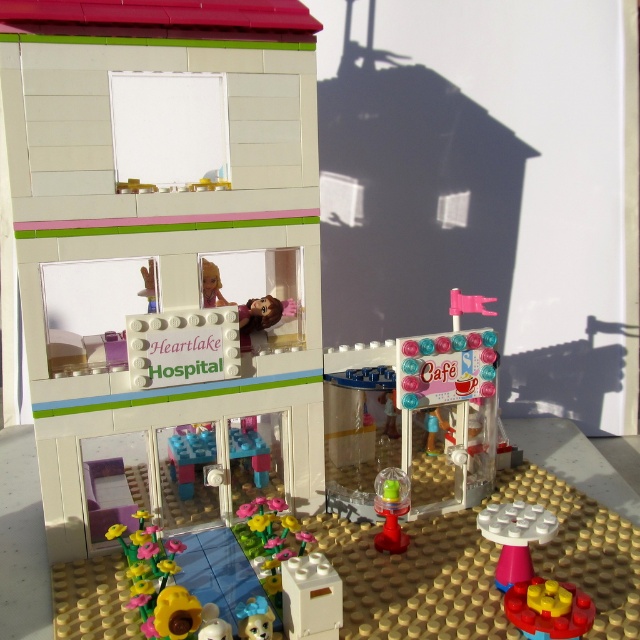
You are a child playing with the LEGO set and want to place a small LEGO figure between the yellow rubber toy at lower right and the translucent yellow plastic cup at lower center. Can you fit the figure between them?

The yellow rubber toy at lower right is positioned on the right side of the translucent yellow plastic cup at lower center, so there is space between them to place the LEGO figure.

You are a photographer standing in front of the LEGO town scene. You want to take a photo focusing on both the point at location (515, 552) and the point at (403, 499). Which point should you adjust your camera focus on first to ensure the closer object is sharp?

Point (515, 552) is closer to the camera than point (403, 499), so you should focus on point (515, 552) first to ensure the closer object is in sharp focus.

You are a LEGO figure standing at point (397, 548) and want to walk to the Heartlake Hospital. Is the point (573, 586) in your path towards the hospital?

Yes, the point (573, 586) is in front of point (397, 548), so it is in your path towards the Heartlake Hospital.